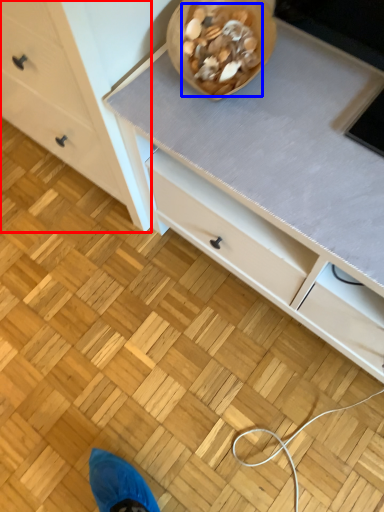
Question: Which point is closer to the camera, chest of drawers (highlighted by a red box) or food (highlighted by a blue box)?

Choices:
 (A) chest of drawers
 (B) food

Answer: (A)